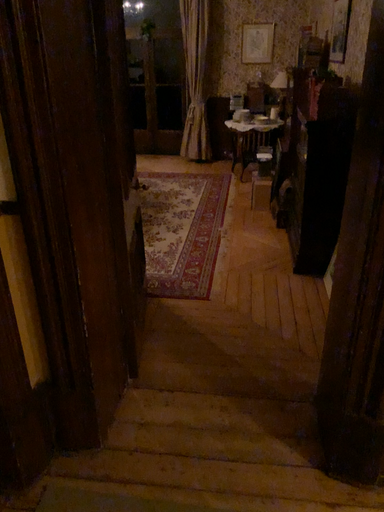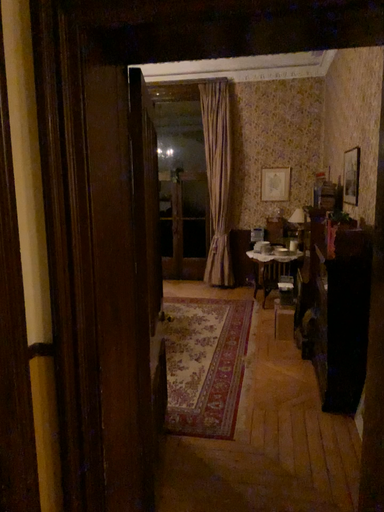
Question: How did the camera likely rotate when shooting the video?

Choices:
 (A) rotated upward
 (B) rotated downward

Answer: (A)